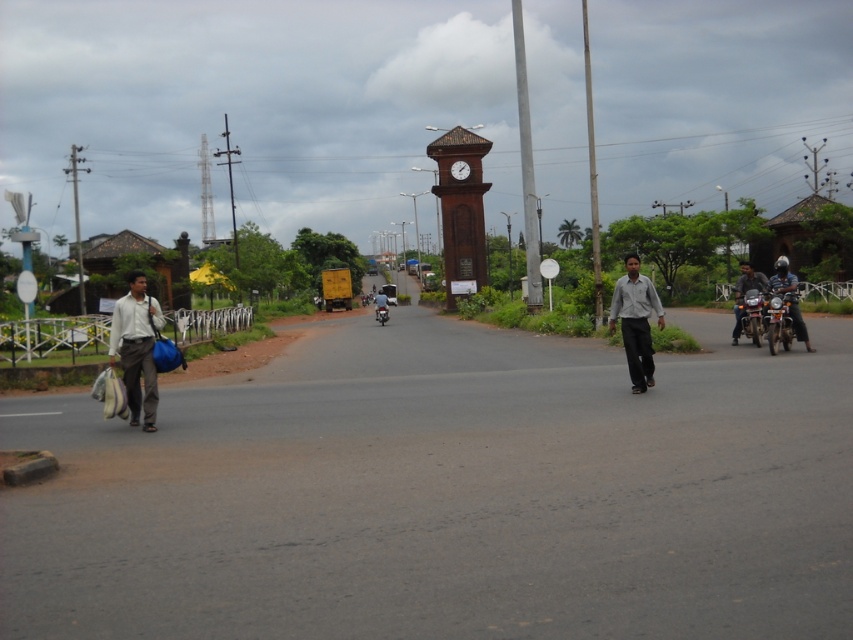
You are a delivery person who needs to place both the light gray fabric bag at left and the shiny chrome motorcycle at right into a storage room. The storage room has a width limit of 1 meter. Based on their sizes, which item might not fit through the entrance?

The light gray fabric bag at left has a larger width than the shiny chrome motorcycle at right, so the light gray fabric bag at left may not fit through the entrance if its width exceeds the 1 meter limit.

You are a pedestrian standing at the edge of the road. You see a light gray shirt at center and a dark blue shirt at right. Which shirt is higher in the image?

The light gray shirt at center is above the dark blue shirt at right, so the light gray shirt at center is higher in the image.

You are standing at point (x=630, y=332) and want to walk to point (x=469, y=148). Is the destination in front of or behind you?

The destination point (x=469, y=148) is behind point (x=630, y=332), so it is behind you.